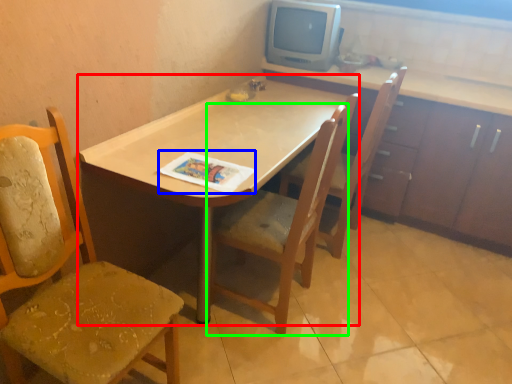
Question: Which object is positioned closest to desk (highlighted by a red box)? Select from magazine (highlighted by a blue box) and chair (highlighted by a green box).

Choices:
 (A) magazine
 (B) chair

Answer: (A)